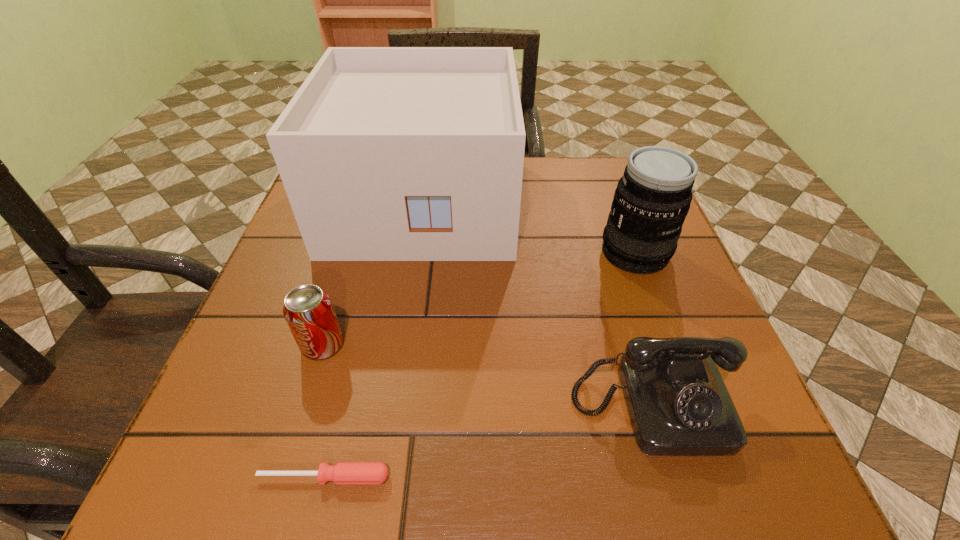
Identify the location of box. pyautogui.click(x=386, y=153).

Identify the location of the fourth shortest object. (652, 199).

Where is `soda can`? soda can is located at coordinates (308, 310).

Locate an element on the screen. This screenshot has height=540, width=960. telephone is located at coordinates coord(678,404).

Where is `the nearest object`? Image resolution: width=960 pixels, height=540 pixels. the nearest object is located at coordinates (343, 472).

Locate an element on the screen. Image resolution: width=960 pixels, height=540 pixels. the shortest object is located at coordinates (343, 472).

Find the location of a particular element. This screenshot has width=960, height=540. blank area located on the side of the tallest object with the window is located at coordinates (410, 286).

Locate an element on the screen. The width and height of the screenshot is (960, 540). free space located 0.320m on the front of the telephoto lens is located at coordinates (700, 428).

At what (x,y) coordinates should I click in order to perform the action: click on vacant space positioned 0.090m on the back of the third nearest object. Please return your answer as a coordinate pair (x, y). The width and height of the screenshot is (960, 540). Looking at the image, I should click on (339, 292).

This screenshot has width=960, height=540. I want to click on vacant region located on the right of the screwdriver, so click(x=607, y=477).